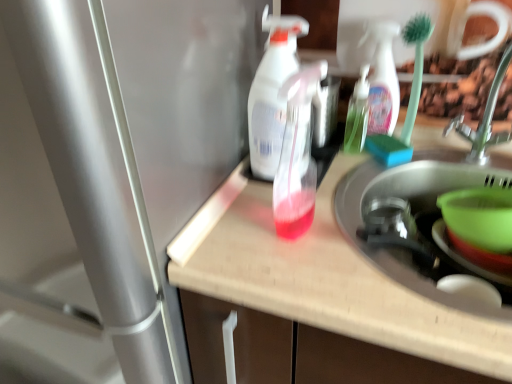
Find the location of a particular element. The image size is (512, 384). vacant space to the right of translucent plastic spray bottle at center is located at coordinates (338, 177).